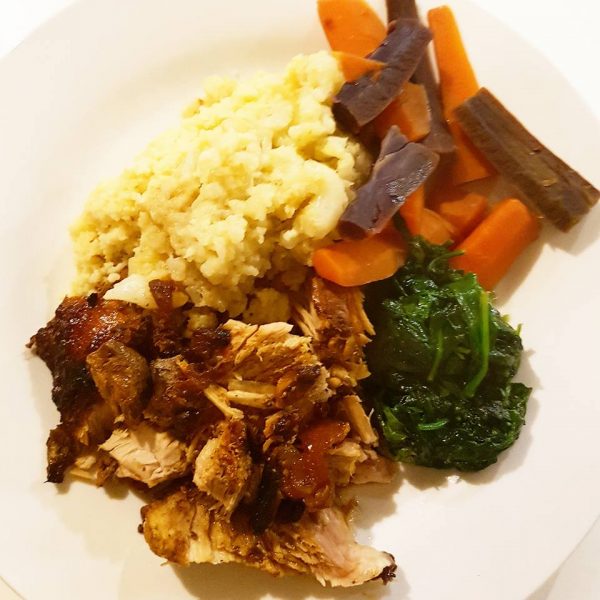
Image resolution: width=600 pixels, height=600 pixels. What are the coordinates of `surface the plate is on` in the screenshot? It's located at (558, 25).